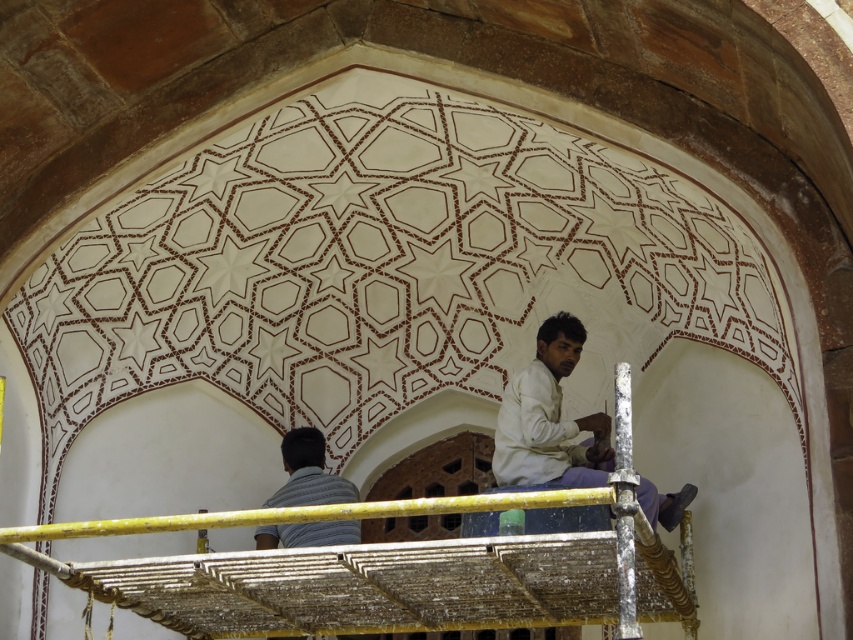
From the picture: You are an architect examining the curved wall with star and hexagonal patterns. You notice two shirts on the scaffolding structure. Which shirt, the white cotton shirt at center or the striped cotton shirt at lower center, is positioned higher up?

The white cotton shirt at center is positioned higher up because it is much taller than the striped cotton shirt at lower center.

You are standing at the base of the scaffolding and want to hand a tool to both the person wearing the white cotton shirt at center and the striped cotton shirt at lower center. Which shirt should you aim for first if you want to reach the closer one first?

The striped cotton shirt at lower center is closer to you than the white cotton shirt at center, so you should aim for the striped cotton shirt at lower center first.

From the picture: You are an inspector on the scaffolding and need to assess the distance between two points marked on the curved wall. The points are labeled as point 1 at coordinates point [587,417] and point 2 at coordinates point [328,486]. Which point is closer to you?

Point [587,417] is further to the viewer than point [328,486], so point [328,486] is closer to you.